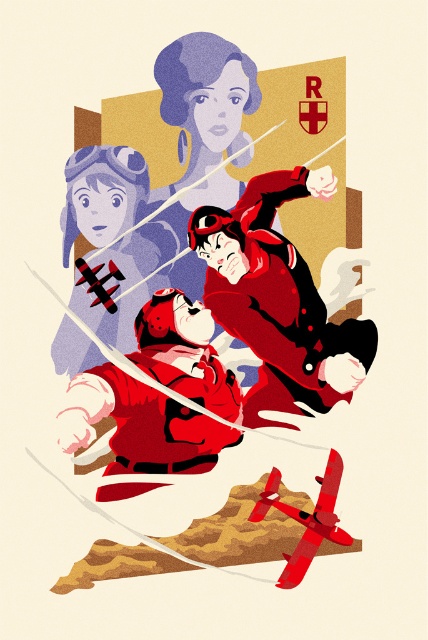
Can you confirm if matte red uniform at center is positioned to the right of matte red helmet at center?

Correct, you'll find matte red uniform at center to the right of matte red helmet at center.

Between matte red uniform at center and matte red helmet at center, which one is positioned lower?

matte red helmet at center is below.

Who is more distant from viewer, [330,356] or [219,397]?

The point [330,356] is behind.

Identify the location of matte red uniform at center. (278, 300).

Is the position of matte red helmet at center less distant than that of matte black helmet at upper left?

Yes, matte red helmet at center is in front of matte black helmet at upper left.

Is point (86, 392) behind point (110, 291)?

No, (86, 392) is in front of (110, 291).

Between point (181, 442) and point (97, 193), which one is positioned in front?

Point (181, 442) is more forward.

This screenshot has height=640, width=428. Find the location of `matte red helmet at center`. matte red helmet at center is located at coordinates (140, 424).

Who is taller, matte red uniform at center or matte black helmet at upper left?

matte red uniform at center

Is matte red uniform at center smaller than matte black helmet at upper left?

No, matte red uniform at center is not smaller than matte black helmet at upper left.

Where is `matte red uniform at center`? This screenshot has height=640, width=428. matte red uniform at center is located at coordinates [x=278, y=300].